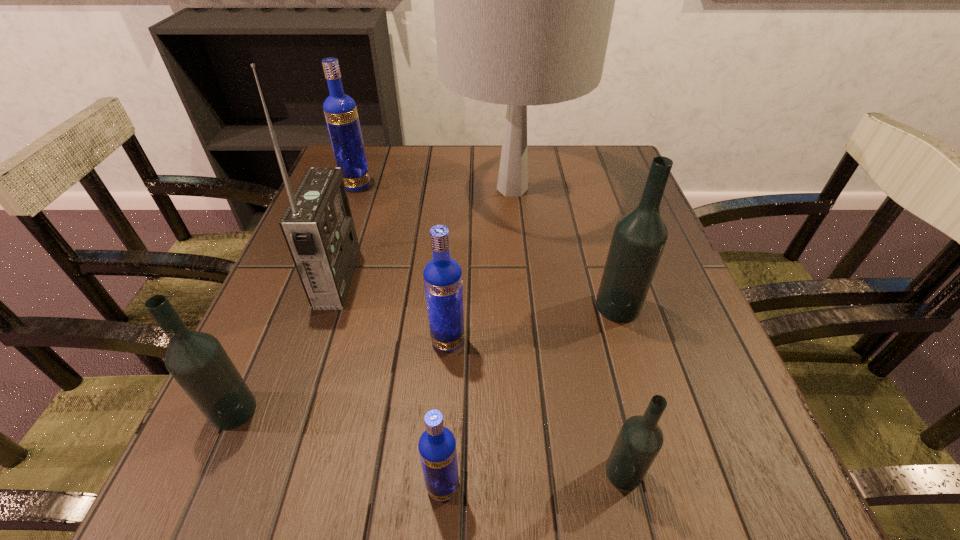
You are a GUI agent. You are given a task and a screenshot of the screen. Output one action in this format:
    pyautogui.click(x=<x>, y=<y>)
    Task: Click on the vacant space at the near edge of the desktop
    The width and height of the screenshot is (960, 540).
    Given the screenshot: What is the action you would take?
    pyautogui.click(x=569, y=476)

Where is `free space at the left edge of the desktop`? This screenshot has height=540, width=960. free space at the left edge of the desktop is located at coordinates (288, 314).

Image resolution: width=960 pixels, height=540 pixels. In the image, there is a desktop. Find the location of `blank space at the right edge`. blank space at the right edge is located at coordinates (687, 349).

At what (x,y) coordinates should I click in order to perform the action: click on vacant region at the far left corner. Please return your answer as a coordinate pair (x, y). The width and height of the screenshot is (960, 540). Looking at the image, I should click on (375, 179).

Where is `vacant point at the far right corner`? vacant point at the far right corner is located at coordinates (599, 156).

At what (x,y) coordinates should I click in order to perform the action: click on vacant space at the near right corner. Please return your answer as a coordinate pair (x, y). Looking at the image, I should click on click(x=725, y=476).

This screenshot has height=540, width=960. In order to click on blank region between the leftmost blue vodka and the smallest blue vodka in this screenshot , I will do `click(399, 336)`.

Image resolution: width=960 pixels, height=540 pixels. Identify the location of vacant area between the radio receiver and the lampshade. (425, 233).

This screenshot has width=960, height=540. Find the location of `free space between the fourth nearest object and the farthest black vodka`. free space between the fourth nearest object and the farthest black vodka is located at coordinates (533, 324).

The width and height of the screenshot is (960, 540). Identify the location of free space between the nearest black vodka and the third farthest vodka. (536, 407).